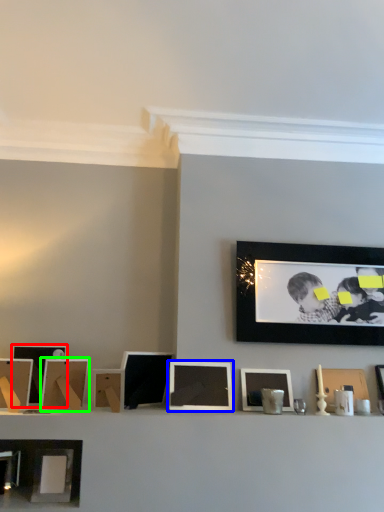
Question: Which is farther away from picture frame (highlighted by a red box)? picture frame (highlighted by a blue box) or picture frame (highlighted by a green box)?

Choices:
 (A) picture frame
 (B) picture frame

Answer: (A)